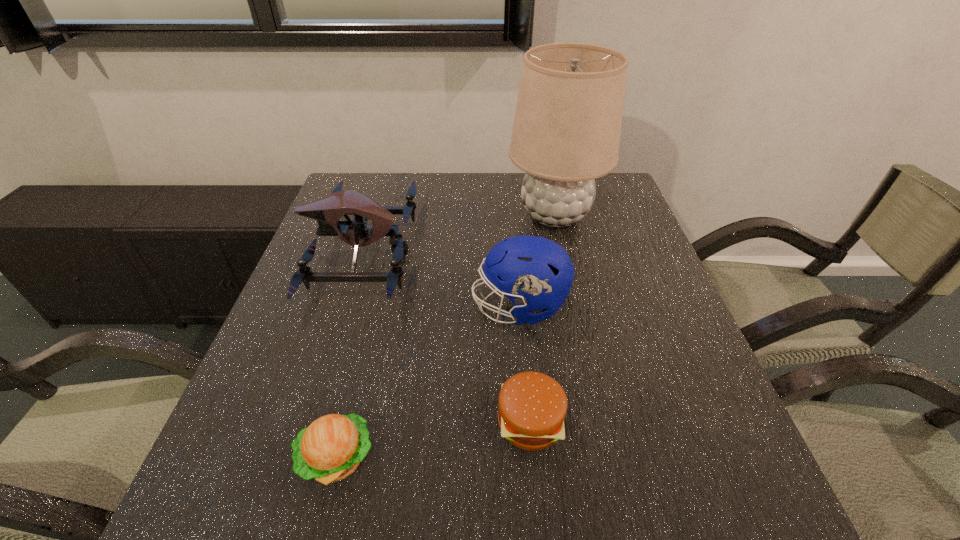
Locate an element on the screen. The image size is (960, 540). the tallest object is located at coordinates (566, 133).

You are a GUI agent. You are given a task and a screenshot of the screen. Output one action in this format:
    pyautogui.click(x=<x>, y=<y>)
    Task: Click on the football helmet
    The image size is (960, 540).
    Given the screenshot: What is the action you would take?
    pyautogui.click(x=535, y=273)

You are a GUI agent. You are given a task and a screenshot of the screen. Output one action in this format:
    pyautogui.click(x=<x>, y=<y>)
    Task: Click on the drone
    This screenshot has width=960, height=540.
    Given the screenshot: What is the action you would take?
    pyautogui.click(x=327, y=210)

The width and height of the screenshot is (960, 540). What are the coordinates of `the left hamburger` in the screenshot? It's located at (330, 449).

You are a GUI agent. You are given a task and a screenshot of the screen. Output one action in this format:
    pyautogui.click(x=<x>, y=<y>)
    Task: Click on the right hamburger
    The height and width of the screenshot is (540, 960).
    Given the screenshot: What is the action you would take?
    pyautogui.click(x=532, y=406)

In order to click on vacant area located 0.050m on the front of the tallest object in this screenshot , I will do `click(564, 256)`.

This screenshot has width=960, height=540. Identify the location of vacant region located on the front-facing side of the football helmet. (412, 307).

Image resolution: width=960 pixels, height=540 pixels. Identify the location of vacant region located on the front-facing side of the football helmet. (338, 307).

Where is `vacant space situated 0.290m on the front-facing side of the football helmet`? vacant space situated 0.290m on the front-facing side of the football helmet is located at coordinates (347, 307).

You are a GUI agent. You are given a task and a screenshot of the screen. Output one action in this format:
    pyautogui.click(x=<x>, y=<y>)
    Task: Click on the free space located on the front-facing side of the drone
    The height and width of the screenshot is (540, 960).
    Given the screenshot: What is the action you would take?
    pyautogui.click(x=564, y=254)